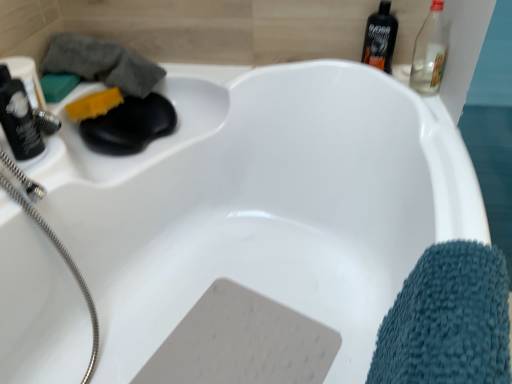
Question: Is metallic silver garden hose at upper left outside of yellow sponge at upper left, the first soap from the right?

Choices:
 (A) no
 (B) yes

Answer: (B)

Question: Does metallic silver garden hose at upper left have a greater height compared to yellow sponge at upper left, the first soap from the right?

Choices:
 (A) no
 (B) yes

Answer: (B)

Question: From a real-world perspective, is metallic silver garden hose at upper left physically above yellow sponge at upper left, the first soap from the right?

Choices:
 (A) no
 (B) yes

Answer: (A)

Question: From the image's perspective, does metallic silver garden hose at upper left appear higher than yellow sponge at upper left, which ranks as the second soap in left-to-right order?

Choices:
 (A) yes
 (B) no

Answer: (B)

Question: Is metallic silver garden hose at upper left to the left of yellow sponge at upper left, the first soap from the right, from the viewer's perspective?

Choices:
 (A) yes
 (B) no

Answer: (A)

Question: Is metallic silver garden hose at upper left thinner than yellow sponge at upper left, which ranks as the second soap in left-to-right order?

Choices:
 (A) yes
 (B) no

Answer: (B)

Question: From a real-world perspective, is teal microfiber towel at lower right, the first bath towel from the bottom, physically above matte black shaver at left, the second bottle from the back?

Choices:
 (A) no
 (B) yes

Answer: (A)

Question: Is teal microfiber towel at lower right, arranged as the second bath towel when viewed from the left, oriented away from matte black shaver at left, the second bottle from the back?

Choices:
 (A) yes
 (B) no

Answer: (A)

Question: Considering the relative sizes of teal microfiber towel at lower right, marked as the second bath towel in a back-to-front arrangement, and matte black shaver at left, acting as the first bottle starting from the left, in the image provided, is teal microfiber towel at lower right, marked as the second bath towel in a back-to-front arrangement, taller than matte black shaver at left, acting as the first bottle starting from the left,?

Choices:
 (A) yes
 (B) no

Answer: (A)

Question: Does teal microfiber towel at lower right, which is the second bath towel from top to bottom, have a lesser width compared to matte black shaver at left, acting as the 2th bottle starting from the top?

Choices:
 (A) yes
 (B) no

Answer: (B)

Question: Is the depth of teal microfiber towel at lower right, marked as the second bath towel in a back-to-front arrangement, less than that of matte black shaver at left, acting as the 2th bottle starting from the top?

Choices:
 (A) no
 (B) yes

Answer: (B)

Question: From the image's perspective, is teal microfiber towel at lower right, which is the first bath towel in right-to-left order, on matte black shaver at left, the second bottle from the back?

Choices:
 (A) no
 (B) yes

Answer: (A)

Question: Is matte black shaver at left, acting as the 1th bottle starting from the bottom, at the back of green matte soap at upper left, which ranks as the 1th soap in left-to-right order?

Choices:
 (A) no
 (B) yes

Answer: (A)